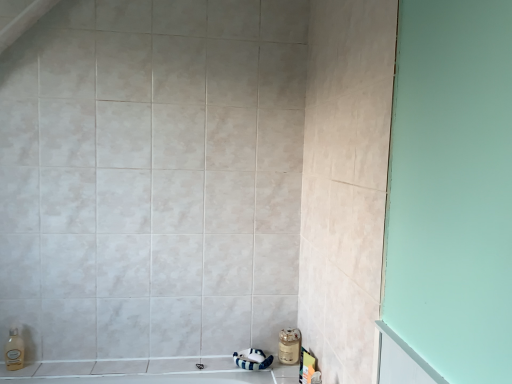
Question: Is point (281, 352) closer or farther from the camera than point (11, 367)?

Choices:
 (A) closer
 (B) farther

Answer: (B)

Question: Is metallic gold jar at lower right bigger or smaller than translucent plastic soap dispenser at lower left?

Choices:
 (A) small
 (B) big

Answer: (B)

Question: From the image's perspective, is metallic gold jar at lower right positioned above or below translucent plastic soap dispenser at lower left?

Choices:
 (A) above
 (B) below

Answer: (B)

Question: From a real-world perspective, is translucent plastic soap dispenser at lower left physically located above or below metallic gold jar at lower right?

Choices:
 (A) above
 (B) below

Answer: (A)

Question: From the image's perspective, is translucent plastic soap dispenser at lower left positioned above or below metallic gold jar at lower right?

Choices:
 (A) below
 (B) above

Answer: (B)

Question: Based on their positions, is translucent plastic soap dispenser at lower left located to the left or right of metallic gold jar at lower right?

Choices:
 (A) right
 (B) left

Answer: (B)

Question: Considering the positions of translucent plastic soap dispenser at lower left and metallic gold jar at lower right in the image, is translucent plastic soap dispenser at lower left taller or shorter than metallic gold jar at lower right?

Choices:
 (A) short
 (B) tall

Answer: (B)